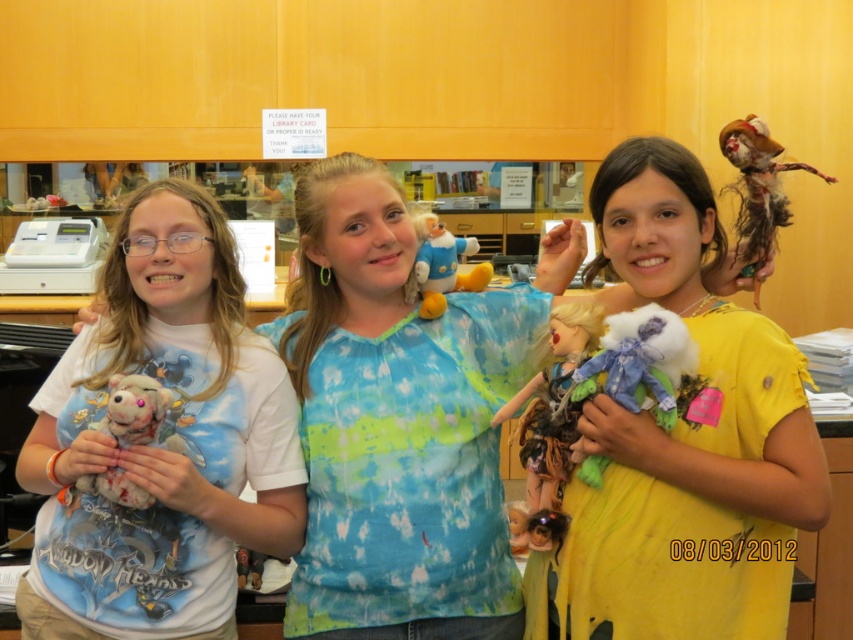
In the image of the library scene, there are two stuffed toys held by the children. The fluffy fabric stuffed animal at center is held by the middle child, and the distressed fabric doll at upper right is held by the right child. Which of these two toys is wider?

The distressed fabric doll at upper right is wider than the fluffy fabric stuffed animal at center.

You are a child who wants to give the fluffy fabric stuffed animal at center to your friend standing 1.5 meters away from you. Can you reach the stuffed animal without moving closer?

The fluffy fabric stuffed animal at center is 1.46 meters away from the viewer. Since your friend is 1.5 meters away, you can reach the stuffed animal as it is slightly closer than your friend.